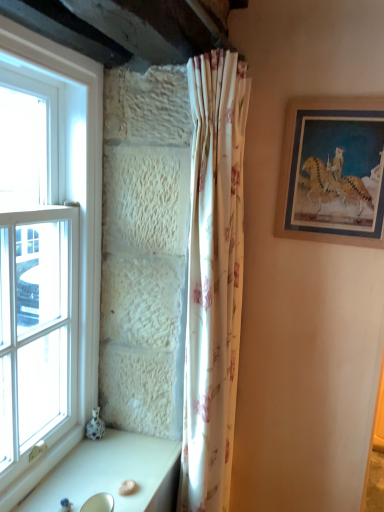
Question: Visually, is white glass window at left positioned to the left or to the right of white floral fabric curtain at center?

Choices:
 (A) right
 (B) left

Answer: (B)

Question: From a real-world perspective, relative to white floral fabric curtain at center, is white glass window at left vertically above or below?

Choices:
 (A) below
 (B) above

Answer: (B)

Question: Which object is positioned closest to the white floral fabric curtain at center?

Choices:
 (A) white glossy table at lower left
 (B) wooden picture frame at upper right
 (C) white glass window at left
 (D) white glossy sink at lower left

Answer: (A)

Question: Which object is the closest to the white glossy sink at lower left?

Choices:
 (A) white glass window at left
 (B) white floral fabric curtain at center
 (C) wooden picture frame at upper right
 (D) white glossy table at lower left

Answer: (D)